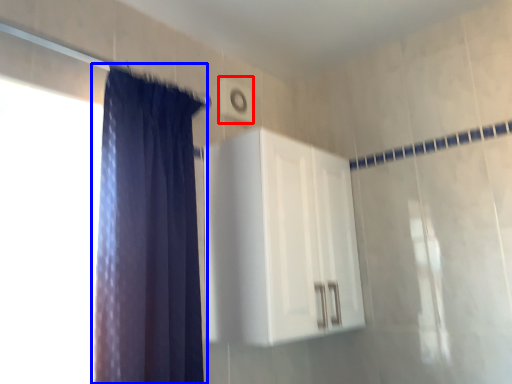
Question: Which of the following is the closest to the observer, light switch (highlighted by a red box) or curtain (highlighted by a blue box)?

Choices:
 (A) light switch
 (B) curtain

Answer: (B)